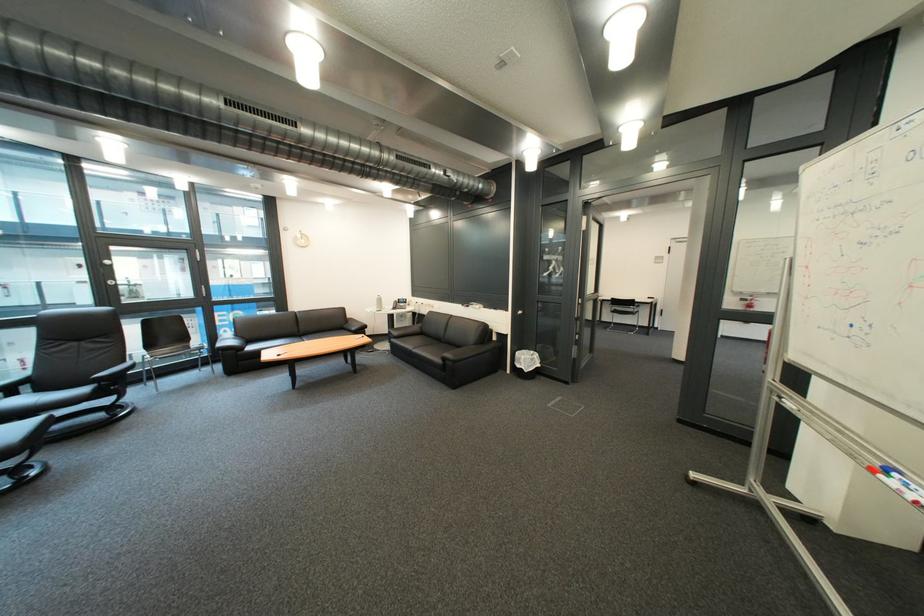
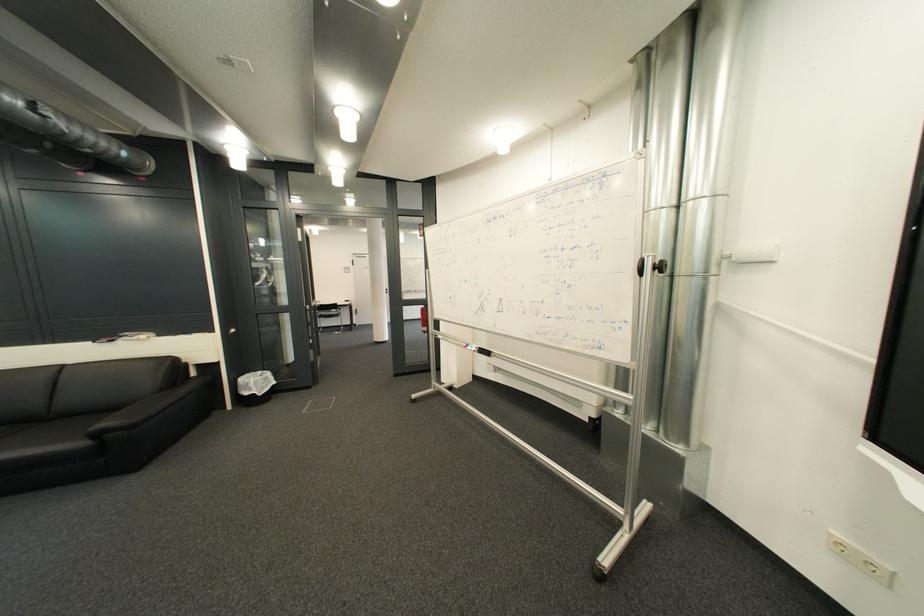
Question: The first image is from the beginning of the video and the second image is from the end. How did the camera likely rotate when shooting the video?

Choices:
 (A) Left
 (B) Right
 (C) Up
 (D) Down

Answer: (B)